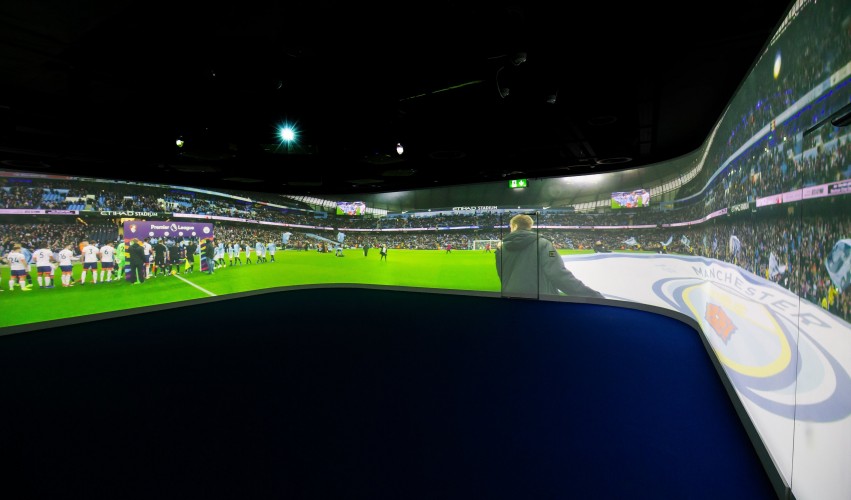
The width and height of the screenshot is (851, 500). What are the coordinates of `floor` in the screenshot? It's located at (420, 410).